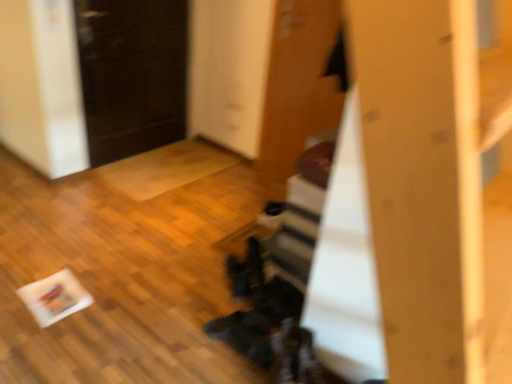
Locate an element on the screen. black glossy door at upper left, the 2th door in the right-to-left sequence is located at coordinates (132, 74).

What do you see at coordinates (132, 74) in the screenshot? The height and width of the screenshot is (384, 512). I see `black glossy door at upper left, the first door in the left-to-right sequence` at bounding box center [132, 74].

Where is `wooden door at upper center, which is the 1th door in right-to-left order`? Image resolution: width=512 pixels, height=384 pixels. wooden door at upper center, which is the 1th door in right-to-left order is located at coordinates (298, 82).

What do you see at coordinates (298, 82) in the screenshot?
I see `wooden door at upper center, which is the 2th door from left to right` at bounding box center [298, 82].

What is the approximate width of wooden door at upper center, which is the 1th door in right-to-left order?

wooden door at upper center, which is the 1th door in right-to-left order, is 0.89 inches wide.

Find the location of a particular element. black glossy door at upper left, the first door in the left-to-right sequence is located at coordinates (132, 74).

Which object is positioned more to the right, black glossy door at upper left, the first door in the left-to-right sequence, or wooden door at upper center, which is the 1th door in right-to-left order?

wooden door at upper center, which is the 1th door in right-to-left order.

Considering their positions, is black glossy door at upper left, the 2th door in the right-to-left sequence, located in front of or behind wooden door at upper center, which is the 2th door from left to right?

black glossy door at upper left, the 2th door in the right-to-left sequence, is positioned farther from the viewer than wooden door at upper center, which is the 2th door from left to right.

Between point (103, 49) and point (260, 142), which one is positioned in front?

The point (103, 49) is more forward.

Consider the image. From the image's perspective, which is above, black glossy door at upper left, the 2th door in the right-to-left sequence, or wooden door at upper center, which is the 2th door from left to right?

From the image's view, black glossy door at upper left, the 2th door in the right-to-left sequence, is above.

From a real-world perspective, which is physically above, black glossy door at upper left, the 2th door in the right-to-left sequence, or wooden door at upper center, which is the 1th door in right-to-left order?

wooden door at upper center, which is the 1th door in right-to-left order, is physically above.

Between black glossy door at upper left, the 2th door in the right-to-left sequence, and wooden door at upper center, which is the 1th door in right-to-left order, which one has smaller width?

wooden door at upper center, which is the 1th door in right-to-left order, is thinner.

Who is shorter, black glossy door at upper left, the 2th door in the right-to-left sequence, or wooden door at upper center, which is the 1th door in right-to-left order?

black glossy door at upper left, the 2th door in the right-to-left sequence.

Can you confirm if black glossy door at upper left, the first door in the left-to-right sequence, is bigger than wooden door at upper center, which is the 2th door from left to right?

Correct, black glossy door at upper left, the first door in the left-to-right sequence, is larger in size than wooden door at upper center, which is the 2th door from left to right.

Is black glossy door at upper left, the 2th door in the right-to-left sequence, positioned beyond the bounds of wooden door at upper center, which is the 1th door in right-to-left order?

black glossy door at upper left, the 2th door in the right-to-left sequence, lies outside wooden door at upper center, which is the 1th door in right-to-left order,'s area.

Is black glossy door at upper left, the first door in the left-to-right sequence, positioned far away from wooden door at upper center, which is the 1th door in right-to-left order?

No.

Could you tell me if black glossy door at upper left, the 2th door in the right-to-left sequence, is turned towards wooden door at upper center, which is the 1th door in right-to-left order?

Yes, black glossy door at upper left, the 2th door in the right-to-left sequence, faces towards wooden door at upper center, which is the 1th door in right-to-left order.

How many degrees apart are the facing directions of black glossy door at upper left, the 2th door in the right-to-left sequence, and wooden door at upper center, which is the 2th door from left to right?

The angle between the facing direction of black glossy door at upper left, the 2th door in the right-to-left sequence, and the facing direction of wooden door at upper center, which is the 2th door from left to right, is 91.5 degrees.

How distant is black glossy door at upper left, the first door in the left-to-right sequence, from wooden door at upper center, which is the 1th door in right-to-left order?

A distance of 38.67 inches exists between black glossy door at upper left, the first door in the left-to-right sequence, and wooden door at upper center, which is the 1th door in right-to-left order.

The image size is (512, 384). In order to click on door below the wooden door at upper center, which is the 2th door from left to right (from a real-world perspective) in this screenshot , I will do `click(132, 74)`.

Is wooden door at upper center, which is the 1th door in right-to-left order, to the right of black glossy door at upper left, the first door in the left-to-right sequence, from the viewer's perspective?

Yes.

Relative to black glossy door at upper left, the first door in the left-to-right sequence, is wooden door at upper center, which is the 2th door from left to right, in front or behind?

Visually, wooden door at upper center, which is the 2th door from left to right, is located in front of black glossy door at upper left, the first door in the left-to-right sequence.

Is point (327, 27) closer or farther from the camera than point (181, 88)?

Point (327, 27) is positioned closer to the camera compared to point (181, 88).

From the image's perspective, is wooden door at upper center, which is the 1th door in right-to-left order, positioned above or below black glossy door at upper left, the first door in the left-to-right sequence?

wooden door at upper center, which is the 1th door in right-to-left order, is situated lower than black glossy door at upper left, the first door in the left-to-right sequence, in the image.

From a real-world perspective, is wooden door at upper center, which is the 1th door in right-to-left order, physically located above or below black glossy door at upper left, the first door in the left-to-right sequence?

In terms of real-world spatial position, wooden door at upper center, which is the 1th door in right-to-left order, is above black glossy door at upper left, the first door in the left-to-right sequence.

Considering the relative sizes of wooden door at upper center, which is the 1th door in right-to-left order, and black glossy door at upper left, the first door in the left-to-right sequence, in the image provided, is wooden door at upper center, which is the 1th door in right-to-left order, thinner than black glossy door at upper left, the first door in the left-to-right sequence,?

Indeed, wooden door at upper center, which is the 1th door in right-to-left order, has a lesser width compared to black glossy door at upper left, the first door in the left-to-right sequence.

Considering the relative sizes of wooden door at upper center, which is the 2th door from left to right, and black glossy door at upper left, the 2th door in the right-to-left sequence, in the image provided, is wooden door at upper center, which is the 2th door from left to right, taller than black glossy door at upper left, the 2th door in the right-to-left sequence,?

Yes, wooden door at upper center, which is the 2th door from left to right, is taller than black glossy door at upper left, the 2th door in the right-to-left sequence.

Considering the sizes of wooden door at upper center, which is the 1th door in right-to-left order, and black glossy door at upper left, the 2th door in the right-to-left sequence, in the image, is wooden door at upper center, which is the 1th door in right-to-left order, bigger or smaller than black glossy door at upper left, the 2th door in the right-to-left sequence,?

In the image, wooden door at upper center, which is the 1th door in right-to-left order, appears to be smaller than black glossy door at upper left, the 2th door in the right-to-left sequence.

Can we say wooden door at upper center, which is the 1th door in right-to-left order, lies outside black glossy door at upper left, the 2th door in the right-to-left sequence?

Yes, wooden door at upper center, which is the 1th door in right-to-left order, is not within black glossy door at upper left, the 2th door in the right-to-left sequence.

Is wooden door at upper center, which is the 2th door from left to right, aimed at black glossy door at upper left, the 2th door in the right-to-left sequence?

No, wooden door at upper center, which is the 2th door from left to right, is not oriented towards black glossy door at upper left, the 2th door in the right-to-left sequence.

How different are the orientations of wooden door at upper center, which is the 2th door from left to right, and black glossy door at upper left, the 2th door in the right-to-left sequence, in degrees?

The facing directions of wooden door at upper center, which is the 2th door from left to right, and black glossy door at upper left, the 2th door in the right-to-left sequence, are 91.5 degrees apart.

The height and width of the screenshot is (384, 512). I want to click on door on the left side of wooden door at upper center, which is the 2th door from left to right, so click(132, 74).

Where is `door behind the wooden door at upper center, which is the 1th door in right-to-left order`? The height and width of the screenshot is (384, 512). door behind the wooden door at upper center, which is the 1th door in right-to-left order is located at coordinates (132, 74).

Find the location of `door directly beneath the wooden door at upper center, which is the 1th door in right-to-left order (from a real-world perspective)`. door directly beneath the wooden door at upper center, which is the 1th door in right-to-left order (from a real-world perspective) is located at coordinates (132, 74).